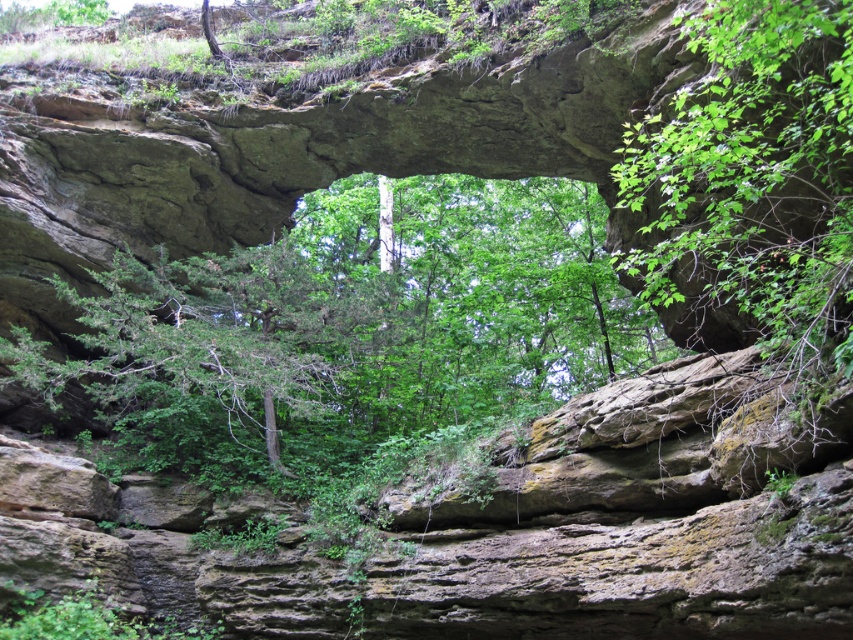
Question: Among these points, which one is farthest from the camera?

Choices:
 (A) (763, 124)
 (B) (439, 234)

Answer: (B)

Question: Which of the following is the closest to the observer?

Choices:
 (A) (753, 259)
 (B) (492, 360)

Answer: (A)

Question: Does green leafy tree at center appear over green leafy tree at upper right?

Choices:
 (A) no
 (B) yes

Answer: (B)

Question: Which of the following is the closest to the observer?

Choices:
 (A) (724, 250)
 (B) (302, 285)

Answer: (A)

Question: Is green leafy tree at center further to camera compared to green leafy tree at upper right?

Choices:
 (A) yes
 (B) no

Answer: (A)

Question: Does green leafy tree at center have a greater width compared to green leafy tree at upper right?

Choices:
 (A) no
 (B) yes

Answer: (B)